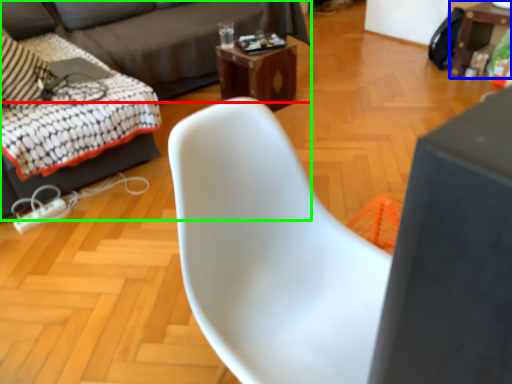
Question: Which is farther away from studio couch (highlighted by a red box)? table (highlighted by a blue box) or studio couch (highlighted by a green box)?

Choices:
 (A) table
 (B) studio couch

Answer: (A)